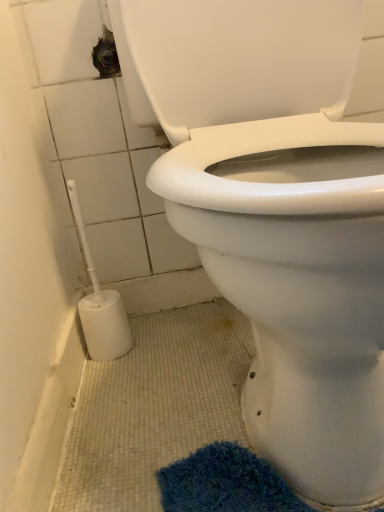
Question: Are white plastic bidet at lower left and white plastic toilet brush at lower left making contact?

Choices:
 (A) no
 (B) yes

Answer: (A)

Question: Is the depth of white plastic bidet at lower left less than that of white plastic toilet brush at lower left?

Choices:
 (A) no
 (B) yes

Answer: (B)

Question: Would you consider white plastic bidet at lower left to be distant from white plastic toilet brush at lower left?

Choices:
 (A) yes
 (B) no

Answer: (B)

Question: From the image's perspective, would you say white plastic bidet at lower left is positioned over white plastic toilet brush at lower left?

Choices:
 (A) no
 (B) yes

Answer: (B)

Question: Does white plastic bidet at lower left have a larger size compared to white plastic toilet brush at lower left?

Choices:
 (A) no
 (B) yes

Answer: (B)

Question: Is white plastic bidet at lower left completely or partially outside of white plastic toilet brush at lower left?

Choices:
 (A) yes
 (B) no

Answer: (A)

Question: Does white plastic toilet brush at lower left lie in front of white plastic bidet at lower left?

Choices:
 (A) no
 (B) yes

Answer: (A)

Question: Does white plastic toilet brush at lower left have a greater width compared to white plastic bidet at lower left?

Choices:
 (A) no
 (B) yes

Answer: (A)

Question: From a real-world perspective, is white plastic toilet brush at lower left located beneath white plastic bidet at lower left?

Choices:
 (A) yes
 (B) no

Answer: (A)

Question: Is white plastic toilet brush at lower left positioned far away from white plastic bidet at lower left?

Choices:
 (A) no
 (B) yes

Answer: (A)

Question: Is white plastic bidet at lower left inside white plastic toilet brush at lower left?

Choices:
 (A) yes
 (B) no

Answer: (B)

Question: Considering the relative sizes of white plastic toilet brush at lower left and white plastic bidet at lower left in the image provided, is white plastic toilet brush at lower left taller than white plastic bidet at lower left?

Choices:
 (A) yes
 (B) no

Answer: (B)

Question: Does point (230, 289) appear closer or farther from the camera than point (92, 294)?

Choices:
 (A) farther
 (B) closer

Answer: (B)